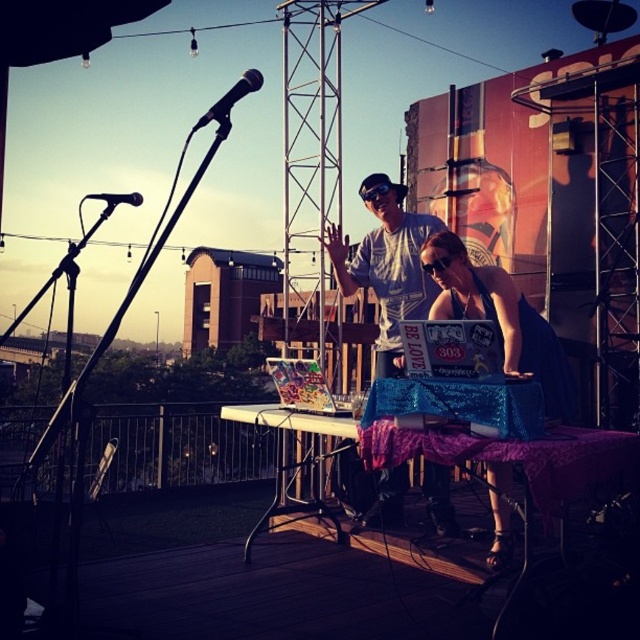
Question: Does black matte microphone at upper center have a greater width compared to black matte microphone at upper left?

Choices:
 (A) no
 (B) yes

Answer: (A)

Question: Which object is closer to the camera taking this photo?

Choices:
 (A) matte white t-shirt at center
 (B) shiny black dress at center
 (C) black matte microphone at upper left
 (D) black matte microphone at upper center

Answer: (D)

Question: Which object is positioned closest to the black matte microphone at upper left?

Choices:
 (A) black matte microphone at upper center
 (B) shiny black dress at center

Answer: (A)

Question: Observing the image, what is the correct spatial positioning of shiny black dress at center in reference to black matte microphone at upper left?

Choices:
 (A) above
 (B) below

Answer: (B)

Question: Is matte white t-shirt at center further to the viewer compared to shiny black dress at center?

Choices:
 (A) yes
 (B) no

Answer: (A)

Question: Considering the real-world distances, which object is closest to the matte white t-shirt at center?

Choices:
 (A) black matte microphone at upper center
 (B) black matte microphone at upper left

Answer: (A)